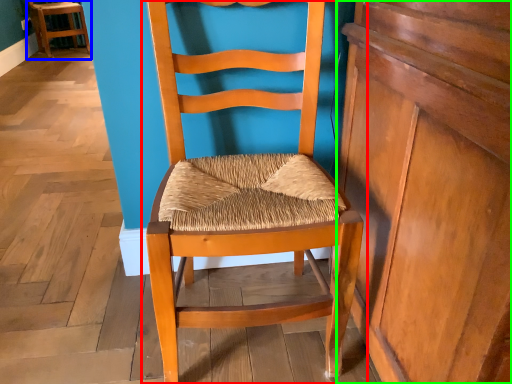
Question: Considering the real-world distances, which object is farthest from chair (highlighted by a red box)? chair (highlighted by a blue box) or dresser (highlighted by a green box)?

Choices:
 (A) chair
 (B) dresser

Answer: (A)